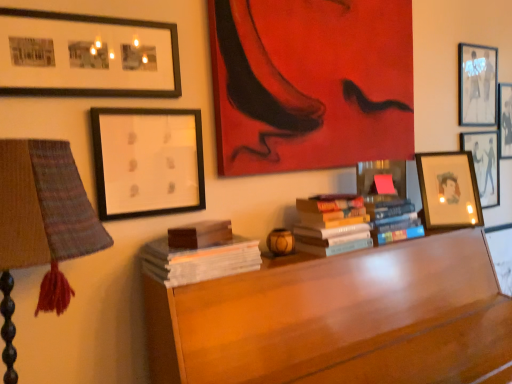
Question: From the image's perspective, relative to matte black picture frame at upper right, the third picture frame from the right, is wooden desk at center above or below?

Choices:
 (A) below
 (B) above

Answer: (A)

Question: Is wooden desk at center bigger or smaller than matte black picture frame at upper right, which appears as the fifth picture frame when viewed from the left?

Choices:
 (A) big
 (B) small

Answer: (A)

Question: Which is nearer to the white paper at upper left, which ranks as the 2th picture frame in left-to-right order?

Choices:
 (A) matte black framed photos at upper left, marked as the seventh picture frame in a right-to-left arrangement
 (B) matte black picture frame at upper right, the third picture frame from the right
 (C) hardcover books at center, marked as the 3th book in a left-to-right arrangement
 (D) matte wooden picture frame at right, the 4th picture frame when ordered from left to right
 (E) matte paper picture frame at right, which is counted as the sixth picture frame, starting from the left

Answer: (A)

Question: Based on their relative distances, which object is farther from the white paper book at left, which is the 4th book in right-to-left order?

Choices:
 (A) matte paper picture frame at right, which is counted as the sixth picture frame, starting from the left
 (B) matte black framed photos at upper left, which appears as the first picture frame when viewed from the left
 (C) hardcover books at center, the second book in the right-to-left sequence
 (D) matte black picture frame at upper right, the seventh picture frame from the left
 (E) wooden desk at center

Answer: (D)